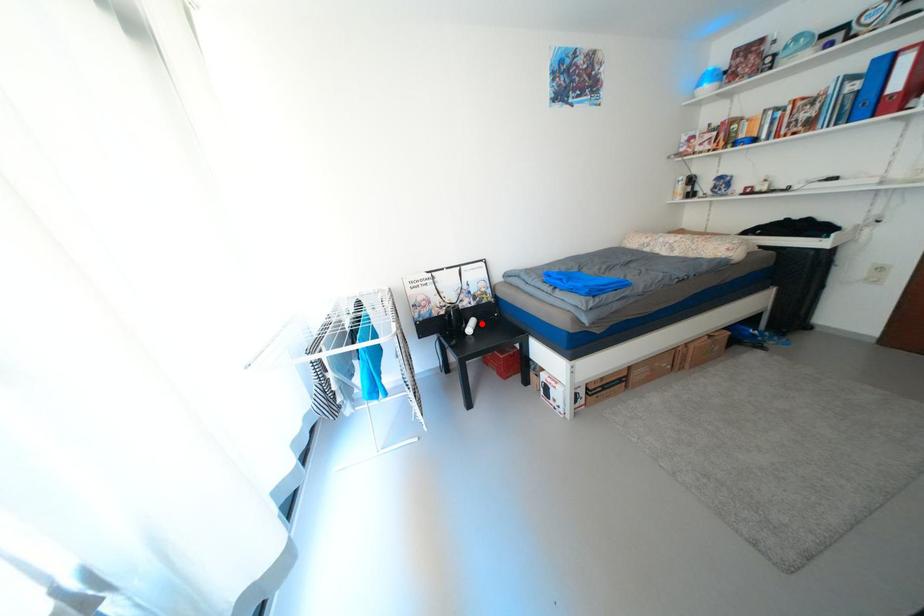
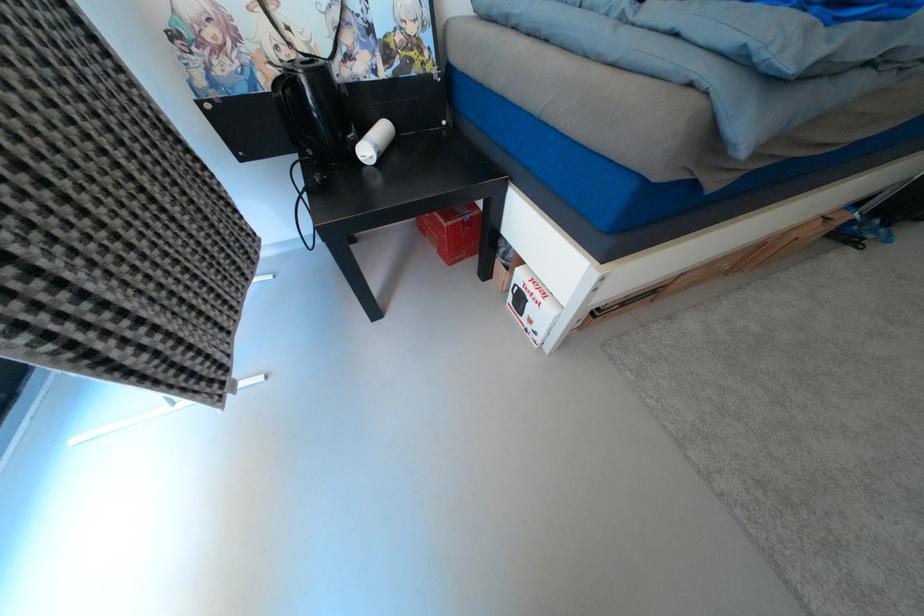
Find the pixel in the second image that matches the highlighted location in the first image.

(392, 132)